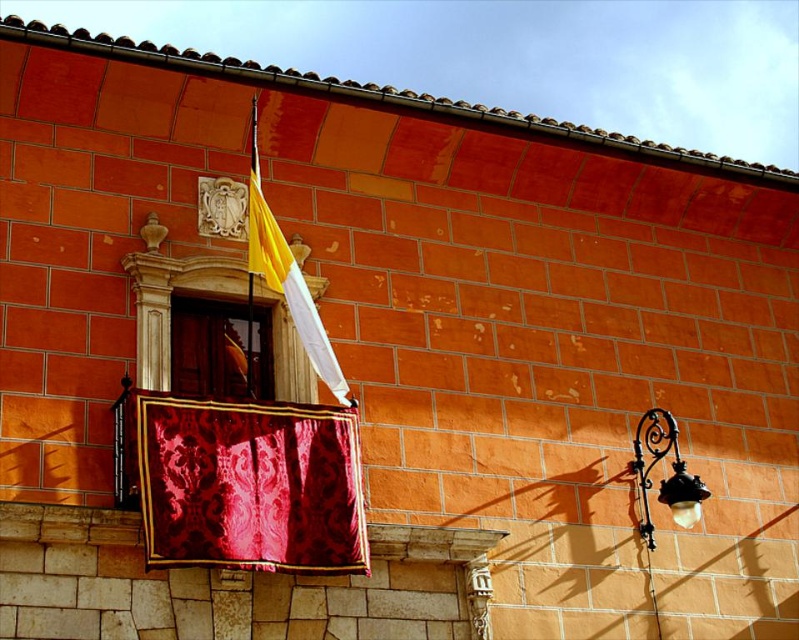
Question: Which point is closer to the camera?

Choices:
 (A) (179, 544)
 (B) (702, 497)
 (C) (265, 378)
 (D) (311, 356)

Answer: (A)

Question: From the image, what is the correct spatial relationship of velvet damask curtain at center in relation to wooden door at center?

Choices:
 (A) below
 (B) above

Answer: (A)

Question: Which object is farther from the camera taking this photo?

Choices:
 (A) yellow fabric flag at upper center
 (B) velvet damask curtain at center
 (C) wooden door at center

Answer: (C)

Question: Is velvet damask curtain at center smaller than yellow fabric flag at upper center?

Choices:
 (A) no
 (B) yes

Answer: (B)

Question: Does velvet damask curtain at center have a larger size compared to black wrought iron streetlight at right?

Choices:
 (A) no
 (B) yes

Answer: (A)

Question: Which of these objects is positioned farthest from the wooden door at center?

Choices:
 (A) yellow fabric flag at upper center
 (B) velvet damask curtain at center
 (C) black wrought iron streetlight at right

Answer: (C)